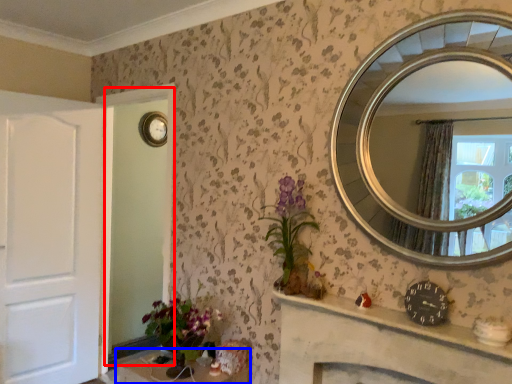
Question: Which object is closer to the camera taking this photo, glass door (highlighted by a red box) or table (highlighted by a blue box)?

Choices:
 (A) glass door
 (B) table

Answer: (B)